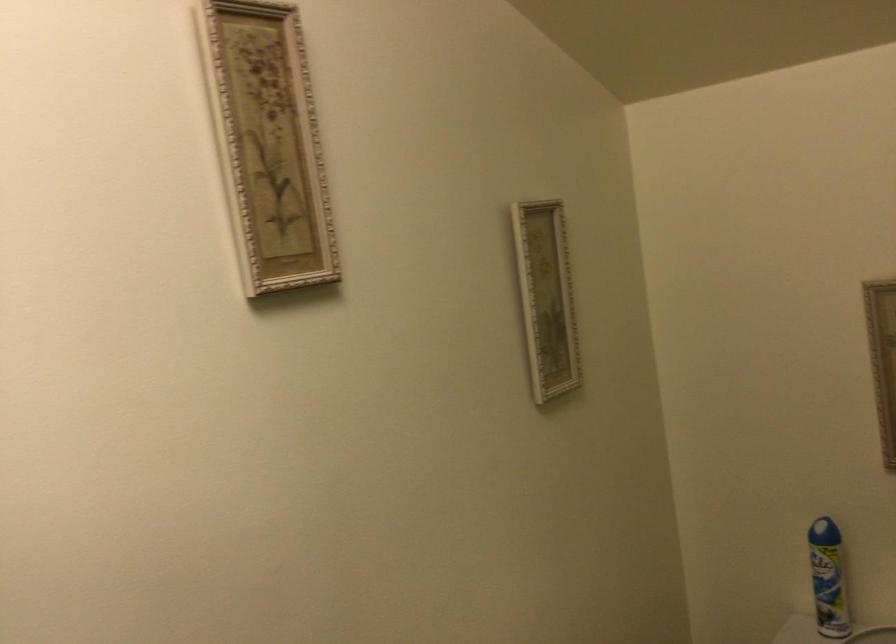
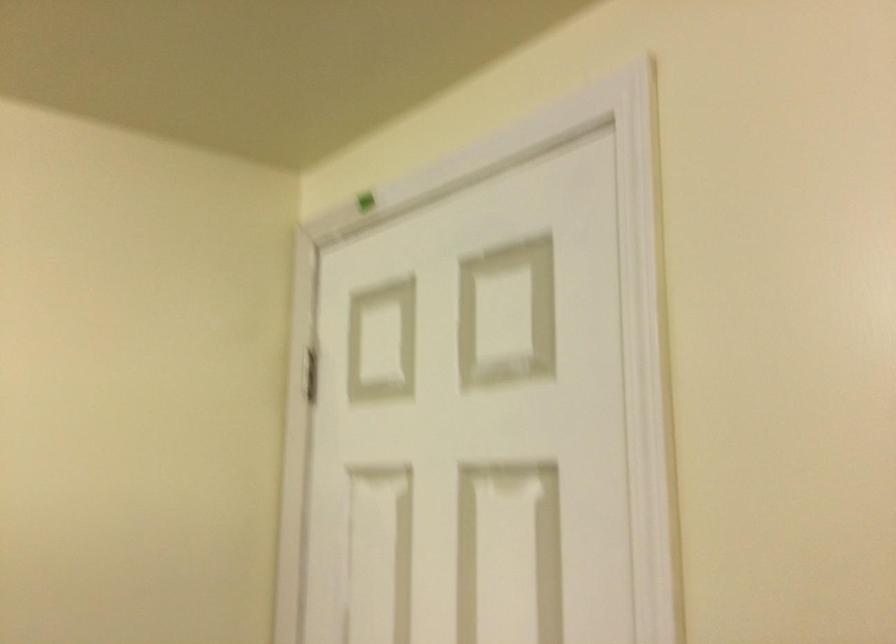
Question: The first image is from the beginning of the video and the second image is from the end. How did the camera likely rotate when shooting the video?

Choices:
 (A) Left
 (B) Right
 (C) Up
 (D) Down

Answer: (A)